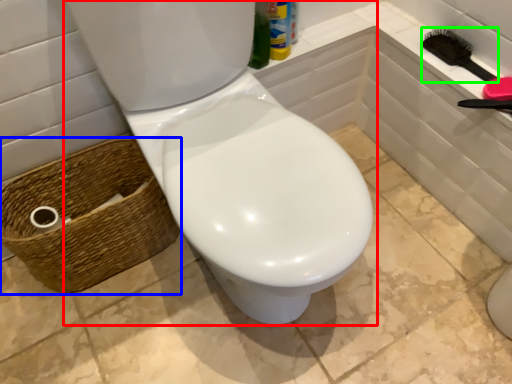
Question: Which object is positioned farthest from toilet (highlighted by a red box)? Select from basket (highlighted by a blue box) and brush (highlighted by a green box).

Choices:
 (A) basket
 (B) brush

Answer: (B)